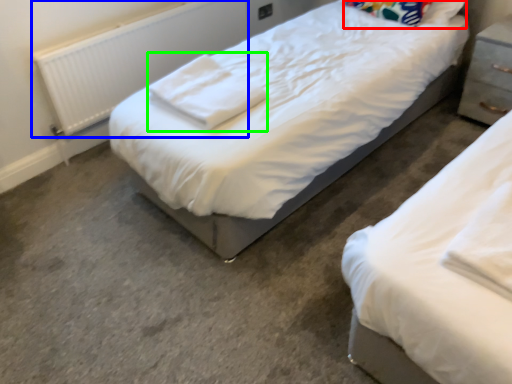
Question: Estimate the real-world distances between objects in this image. Which object is farther from pillow (highlighted by a red box), radiator (highlighted by a blue box) or cloth (highlighted by a green box)?

Choices:
 (A) radiator
 (B) cloth

Answer: (A)